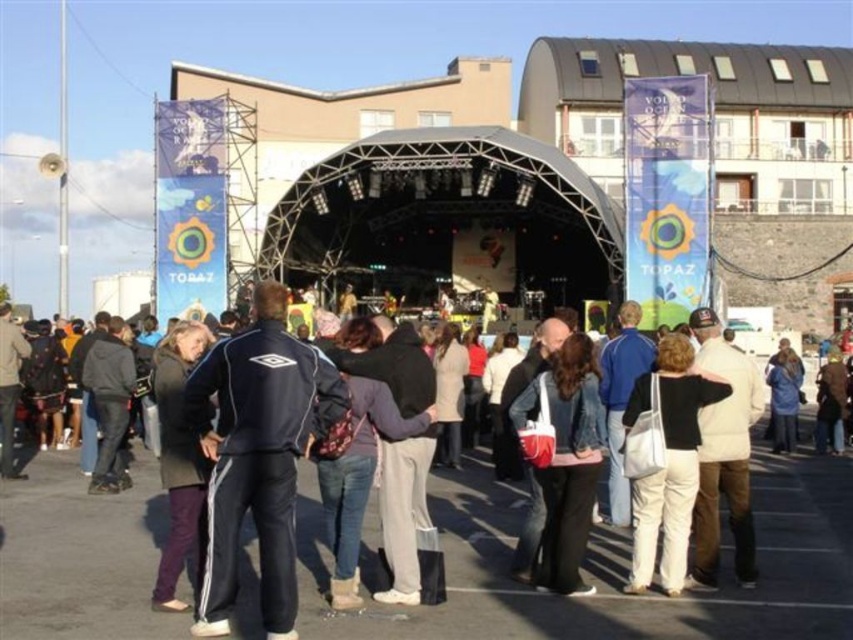
You are attending an outdoor event and see two people wearing dark blue track pants at center and black track suit at center. Which one is positioned to the right?

The dark blue track pants at center is positioned to the right of the black track suit at center.

You are a photographer positioned at the back of the crowd. You want to take a photo of both the dark blue track pants at center and the black track suit at center. Which one will appear closer to you in the photo?

The dark blue track pants at center will appear closer to you in the photo because it is positioned closer to the viewer than the black track suit at center.